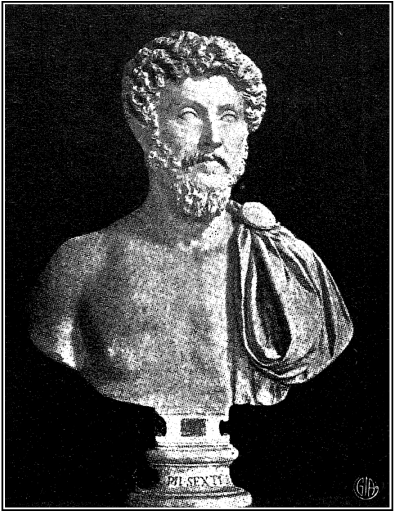
Where is `chest`? This screenshot has height=512, width=394. chest is located at coordinates (140, 300), (219, 296).